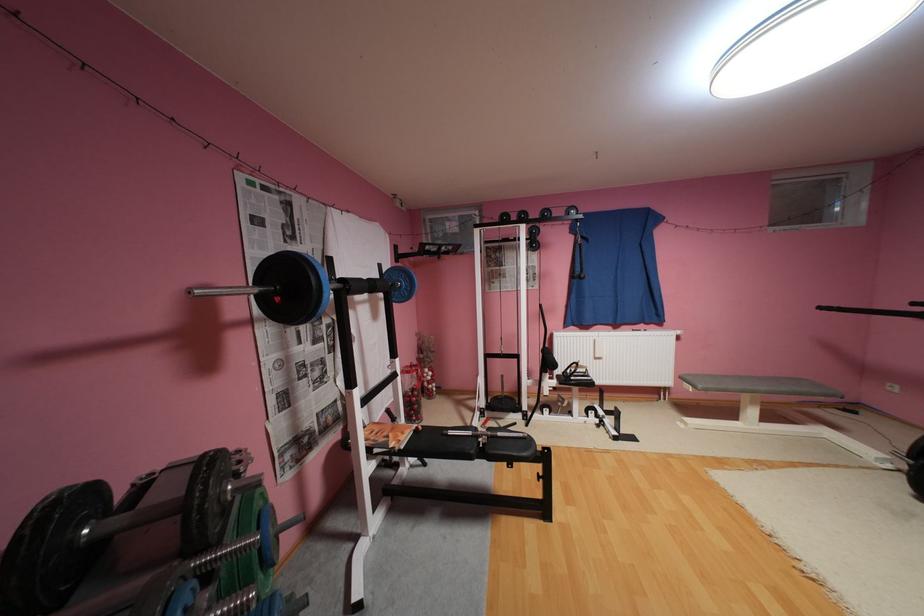
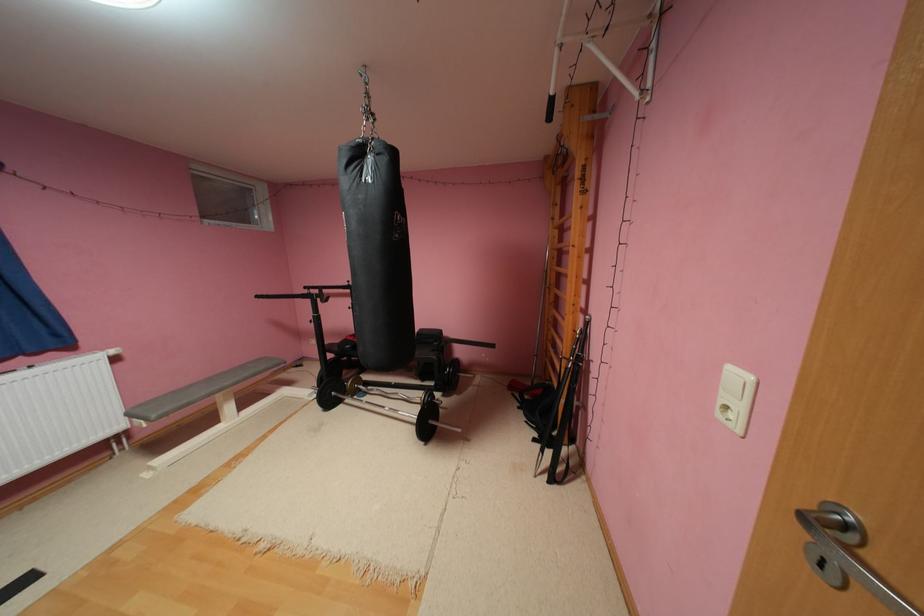
Question: Based on the continuous images, in which direction is the camera rotating? Reply with the corresponding letter.

Choices:
 (A) Left
 (B) Right
 (C) Up
 (D) Down

Answer: (B)